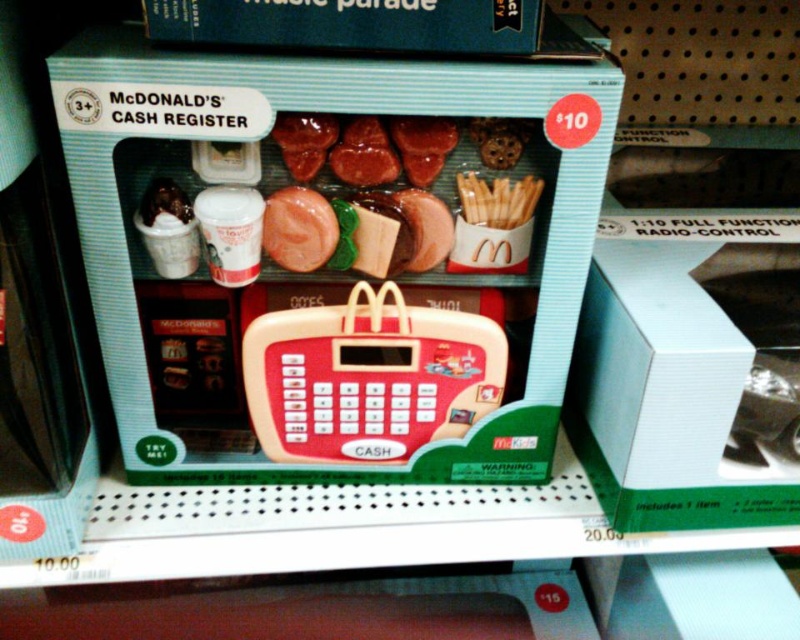
Is white cardboard box at right smaller than shiny chocolate bar at center?

No, white cardboard box at right is not smaller than shiny chocolate bar at center.

Which is behind, point (649, 472) or point (148, 186)?

Point (649, 472)

Between point (694, 451) and point (146, 224), which one is positioned behind?

The point (694, 451) is behind.

Where is `white cardboard box at right`? Image resolution: width=800 pixels, height=640 pixels. white cardboard box at right is located at coordinates (676, 392).

Can you confirm if matte plastic toy cash register at center is positioned to the left of white cardboard box at right?

Correct, you'll find matte plastic toy cash register at center to the left of white cardboard box at right.

Describe the element at coordinates (330, 259) in the screenshot. I see `matte plastic toy cash register at center` at that location.

Locate an element on the screen. The image size is (800, 640). matte plastic toy cash register at center is located at coordinates (330, 259).

What do you see at coordinates (498, 198) in the screenshot? I see `golden crispy fries at center` at bounding box center [498, 198].

Can you confirm if golden crispy fries at center is positioned above shiny chocolate bar at center?

Correct, golden crispy fries at center is located above shiny chocolate bar at center.

Where is `golden crispy fries at center`? Image resolution: width=800 pixels, height=640 pixels. golden crispy fries at center is located at coordinates (498, 198).